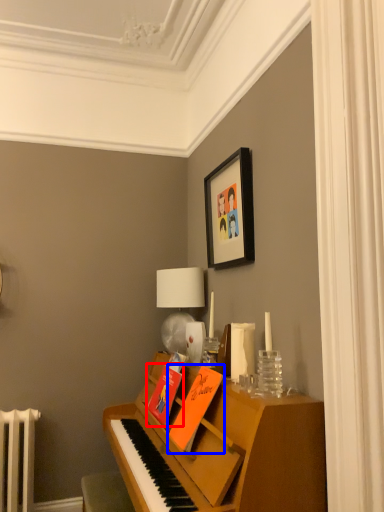
Question: Which object is further to the camera taking this photo, book (highlighted by a red box) or book (highlighted by a blue box)?

Choices:
 (A) book
 (B) book

Answer: (A)